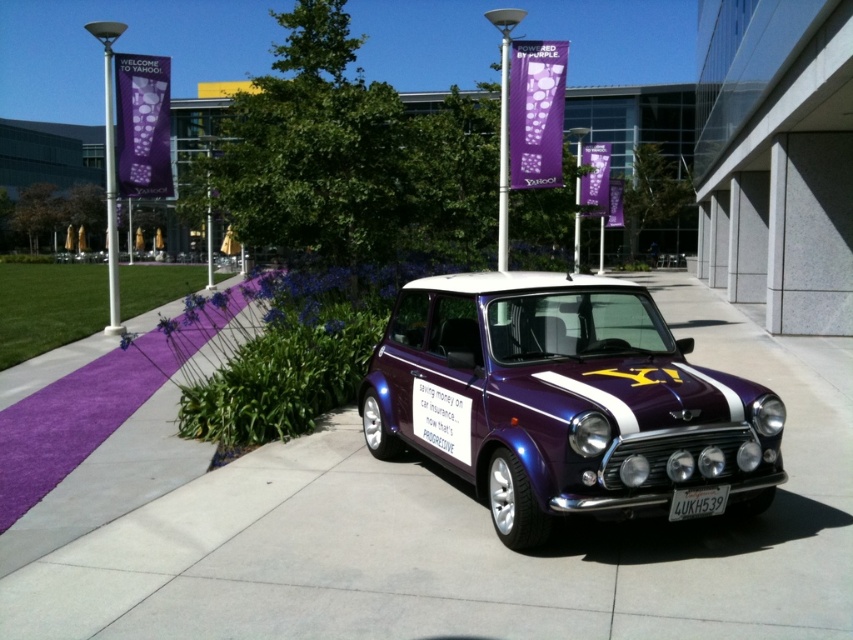
You are a delivery person who needs to place a small box on either the purple asphalt at center or the white plastic license plate at center. Which surface can you place the box on without it being hidden by the other object?

The purple asphalt at center is taller than the white plastic license plate at center, so placing the box on the purple asphalt at center will prevent it from being hidden by the license plate.

You are a pedestrian standing on the purple asphalt at center. You want to look at the shiny purple car at center. In which direction should you look?

The purple asphalt at center is located below the shiny purple car at center, so you should look upwards to see the shiny purple car at center.